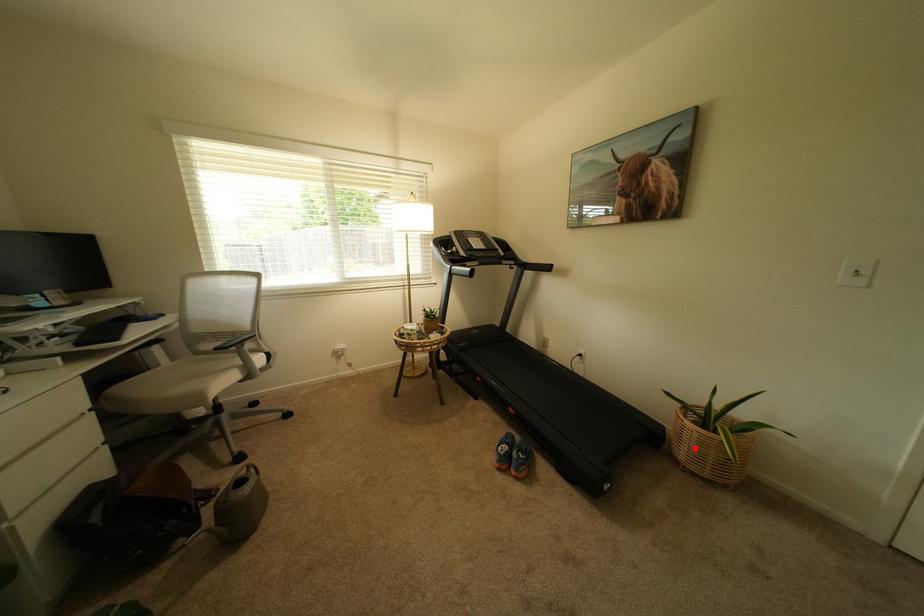
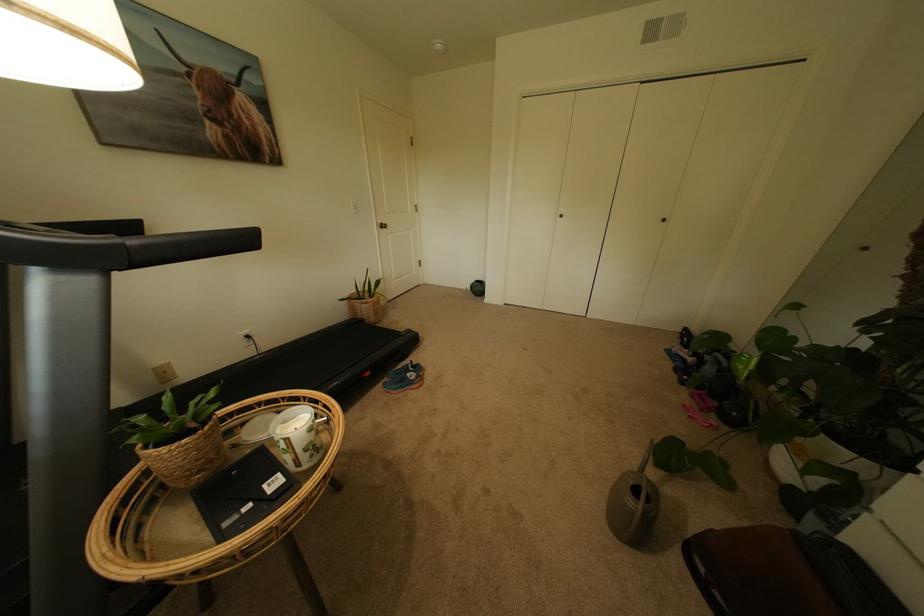
Find the pixel in the second image that matches the highlighted location in the first image.

(382, 314)